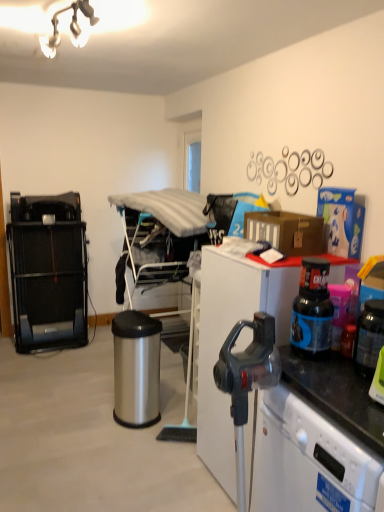
Locate an element on the screen. The height and width of the screenshot is (512, 384). translucent plastic bottle at right is located at coordinates (369, 337).

What are the coordinates of `metal/textured drying rack at center` in the screenshot? It's located at (158, 236).

Find the location of a particular element. This screenshot has width=384, height=512. polished stainless steel trash can at center is located at coordinates (136, 368).

Measure the distance between black plastic bottle at right and camera.

They are 1.56 meters apart.

I want to click on black metal treadmill at left, so click(x=48, y=284).

The width and height of the screenshot is (384, 512). I want to click on white matte desk at right, so click(228, 333).

Are black metal treadmill at left and black plastic bottle at right located far from each other?

→ Yes, black metal treadmill at left and black plastic bottle at right are quite far apart.

Does black metal treadmill at left have a smaller size compared to black plastic bottle at right?

Actually, black metal treadmill at left might be larger than black plastic bottle at right.

In the scene shown: Which is more to the right, black metal treadmill at left or black plastic bottle at right?

black plastic bottle at right.

Which of these two, black metal treadmill at left or black plastic bottle at right, stands shorter?

black plastic bottle at right is shorter.

Is point (314, 257) closer to camera compared to point (285, 340)?

No, it is not.

The height and width of the screenshot is (512, 384). In order to click on desk on the left of black plastic bottle at right in this screenshot , I will do `click(228, 333)`.

Which object is thinner, black plastic bottle at right or white matte desk at right?

With smaller width is black plastic bottle at right.

Who is smaller, black plastic bottle at right or white matte desk at right?

With smaller size is black plastic bottle at right.

The image size is (384, 512). Identify the location of bottle that is in front of the polished stainless steel trash can at center. (312, 310).

From a real-world perspective, is black plastic bottle at right under polished stainless steel trash can at center?

Incorrect, from a real-world perspective, black plastic bottle at right is higher than polished stainless steel trash can at center.

Who is shorter, black plastic bottle at right or polished stainless steel trash can at center?

black plastic bottle at right.

Is black plastic bottle at right next to polished stainless steel trash can at center and touching it?

No.

Is polished stainless steel trash can at center positioned with its back to translucent plastic bottle at right?

No, polished stainless steel trash can at center is not facing away from translucent plastic bottle at right.

From the image's perspective, is polished stainless steel trash can at center positioned above or below translucent plastic bottle at right?

polished stainless steel trash can at center is situated lower than translucent plastic bottle at right in the image.

How much distance is there between polished stainless steel trash can at center and translucent plastic bottle at right?

A distance of 4.95 feet exists between polished stainless steel trash can at center and translucent plastic bottle at right.

Identify the location of appliance above the polished stainless steel trash can at center (from a real-world perspective). Image resolution: width=384 pixels, height=512 pixels. (369, 337).

In the image, is white matte desk at right positioned in front of or behind translucent plastic bottle at right?

white matte desk at right is behind translucent plastic bottle at right.

Are white matte desk at right and translucent plastic bottle at right located far from each other?

No, white matte desk at right is not far away from translucent plastic bottle at right.

From the image's perspective, which one is positioned lower, white matte desk at right or translucent plastic bottle at right?

From the image's view, white matte desk at right is below.

In the image, is black plastic bottle at right on the left side or the right side of black metal treadmill at left?

black plastic bottle at right is positioned on black metal treadmill at left's right side.

From a real-world perspective, is black plastic bottle at right positioned under black metal treadmill at left based on gravity?

Incorrect, from a real-world perspective, black plastic bottle at right is higher than black metal treadmill at left.

Would you say black plastic bottle at right is inside or outside black metal treadmill at left?

black plastic bottle at right is located beyond the bounds of black metal treadmill at left.

From the image's perspective, which object appears higher, black plastic bottle at right or black metal treadmill at left?

black metal treadmill at left is shown above in the image.

Is metal/textured drying rack at center directly adjacent to white matte desk at right?

No, metal/textured drying rack at center is not in contact with white matte desk at right.

From the image's perspective, would you say metal/textured drying rack at center is shown under white matte desk at right?

No, from the image's perspective, metal/textured drying rack at center is not beneath white matte desk at right.

Is metal/textured drying rack at center inside or outside of white matte desk at right?

metal/textured drying rack at center is spatially situated outside white matte desk at right.

How different are the orientations of metal/textured drying rack at center and white matte desk at right in degrees?

There is a 2.54-degree angle between the facing directions of metal/textured drying rack at center and white matte desk at right.

At what (x,y) coordinates should I click in order to perform the action: click on cabinetry on the left of the black plastic bottle at right. Please return your answer as a coordinate pair (x, y). The image size is (384, 512). Looking at the image, I should click on (48, 284).

Where is `bottle above the white matte desk at right (from the image's perspective)`? This screenshot has height=512, width=384. bottle above the white matte desk at right (from the image's perspective) is located at coordinates (312, 310).

When comparing their distances from brown cardboard box at upper right, does black plastic bottle at right or black metal treadmill at left seem closer?

black plastic bottle at right is positioned closer to the anchor brown cardboard box at upper right.

Which object lies nearer to the anchor point white glossy dishwasher at lower right, white matte desk at right or brown cardboard box at upper right?

Based on the image, white matte desk at right appears to be nearer to white glossy dishwasher at lower right.

Which object lies further to the anchor point black metal treadmill at left, metal/textured drying rack at center or brown cardboard box at upper right?

brown cardboard box at upper right is positioned further to the anchor black metal treadmill at left.

Looking at this image, when comparing their distances from polished stainless steel trash can at center, does black plastic bottle at right or white matte desk at right seem closer?

Among the two, white matte desk at right is located nearer to polished stainless steel trash can at center.

From the image, which object appears to be nearer to black metal treadmill at left, white glossy dishwasher at lower right or white matte desk at right?

Based on the image, white matte desk at right appears to be nearer to black metal treadmill at left.

In the scene shown: Estimate the real-world distances between objects in this image. Which object is further from metal/textured drying rack at center, black metal treadmill at left or white matte desk at right?

white matte desk at right.

Estimate the real-world distances between objects in this image. Which object is further from white glossy dishwasher at lower right, polished stainless steel trash can at center or brown cardboard box at upper right?

The object further to white glossy dishwasher at lower right is polished stainless steel trash can at center.

Estimate the real-world distances between objects in this image. Which object is closer to brown cardboard box at upper right, black metal treadmill at left or polished stainless steel trash can at center?

Among the two, polished stainless steel trash can at center is located nearer to brown cardboard box at upper right.

Identify the location of furniture positioned between translucent plastic bottle at right and black metal treadmill at left from near to far. This screenshot has width=384, height=512. (158, 236).

Locate an element on the screen. box between white glossy dishwasher at lower right and black metal treadmill at left in the front-back direction is located at coordinates (286, 231).

The height and width of the screenshot is (512, 384). I want to click on bottle between white glossy dishwasher at lower right and polished stainless steel trash can at center from front to back, so click(312, 310).

Identify the location of trash bin/can between brown cardboard box at upper right and metal/textured drying rack at center from front to back. (x=136, y=368).